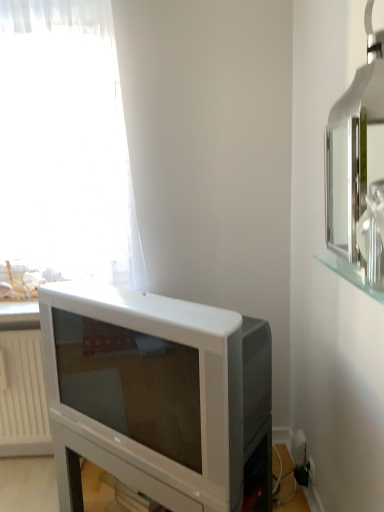
Question: Based on their positions, is silver metallic medicine cabinet at upper right located to the left or right of white plastic radiator at lower left?

Choices:
 (A) right
 (B) left

Answer: (A)

Question: From the image's perspective, is silver metallic medicine cabinet at upper right positioned above or below white plastic radiator at lower left?

Choices:
 (A) above
 (B) below

Answer: (A)

Question: Which object is positioned closest to the white plastic radiator at lower left?

Choices:
 (A) white sheer curtain at upper left
 (B) silver metallic medicine cabinet at upper right
 (C) white plastic television at lower left

Answer: (C)

Question: Which object is the farthest from the white sheer curtain at upper left?

Choices:
 (A) silver metallic medicine cabinet at upper right
 (B) white plastic radiator at lower left
 (C) white plastic television at lower left

Answer: (A)